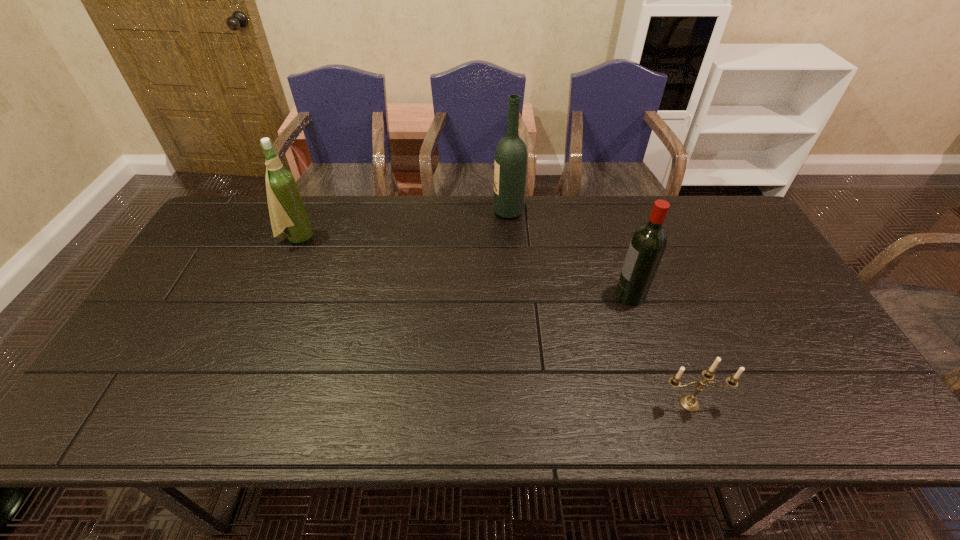
Locate an element on the screen. The image size is (960, 540). the farthest wine bottle is located at coordinates (510, 166).

Where is `the farthest object`? This screenshot has height=540, width=960. the farthest object is located at coordinates click(x=510, y=166).

Where is `the leftmost object`? The image size is (960, 540). the leftmost object is located at coordinates (287, 211).

The width and height of the screenshot is (960, 540). I want to click on the second nearest wine bottle, so click(x=287, y=211).

This screenshot has height=540, width=960. Find the location of `the second nearest object`. the second nearest object is located at coordinates (648, 243).

The height and width of the screenshot is (540, 960). What are the coordinates of `the rightmost wine bottle` in the screenshot? It's located at (648, 243).

The image size is (960, 540). In order to click on the nearest object in this screenshot , I will do `click(688, 402)`.

Where is `candle`? Image resolution: width=960 pixels, height=540 pixels. candle is located at coordinates coord(688,402).

At what (x,y) coordinates should I click in order to perform the action: click on free space located on the labeled side of the farthest object. Please return your answer as a coordinate pair (x, y). The width and height of the screenshot is (960, 540). Looking at the image, I should click on (416, 212).

I want to click on free region located on the labeled side of the farthest object, so click(374, 212).